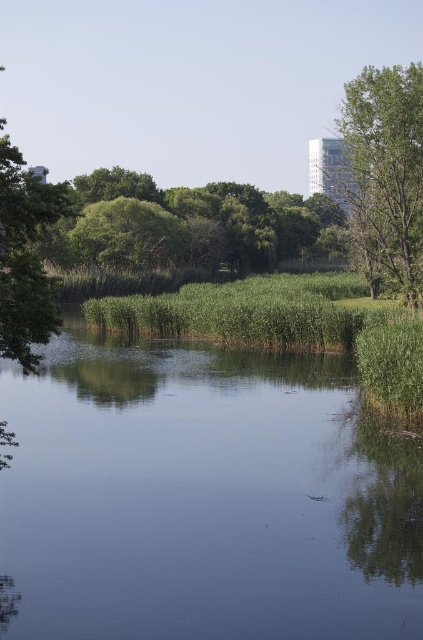
Is the position of green grassy river at center more distant than that of green leafy tree at upper right?

Answer: No, it is in front of green leafy tree at upper right.

Between point (331, 419) and point (386, 179), which one is positioned behind?

Point (386, 179)

Locate an element on the screen. green grassy river at center is located at coordinates (205, 497).

The image size is (423, 640). Describe the element at coordinates (384, 173) in the screenshot. I see `green leafy tree at upper right` at that location.

Is green leafy tree at upper right wider than green leafy tree at left?

Indeed, green leafy tree at upper right has a greater width compared to green leafy tree at left.

Is point (359, 88) behind point (19, 259)?

That is True.

This screenshot has height=640, width=423. In order to click on green leafy tree at upper right in this screenshot , I will do `click(384, 173)`.

Can you confirm if green grassy river at center is thinner than green leafy tree at left?

Correct, green grassy river at center's width is less than green leafy tree at left's.

Who is positioned more to the right, green grassy river at center or green leafy tree at left?

Positioned to the right is green grassy river at center.

Where is `green grassy river at center`? The image size is (423, 640). green grassy river at center is located at coordinates (205, 497).

At what (x,y) coordinates should I click in order to perform the action: click on green grassy river at center. Please return your answer as a coordinate pair (x, y). The image size is (423, 640). Looking at the image, I should click on (205, 497).